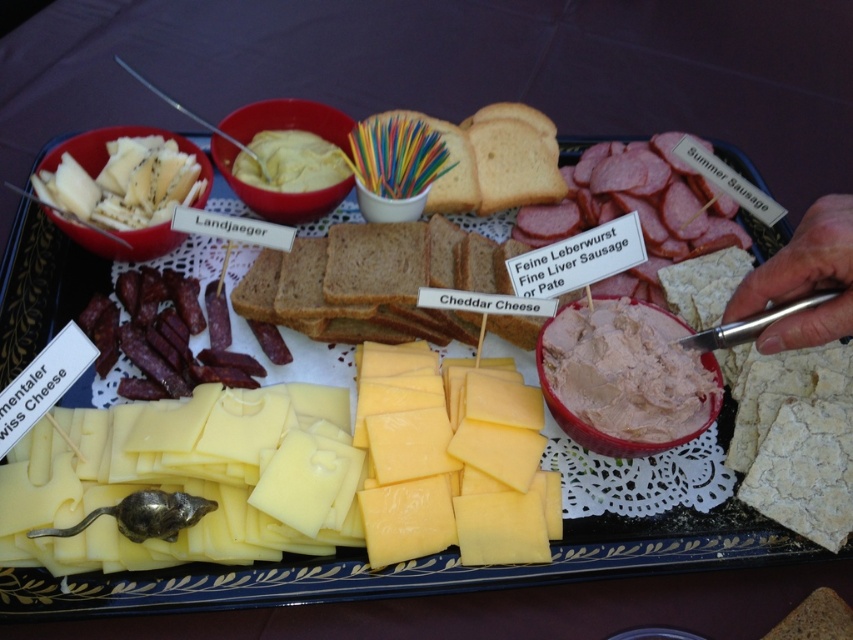
You are a guest at a party and see the brown matte bread at center and the white creamy spread at center on the charcuterie board. Which item is located below the other?

The brown matte bread at center is positioned under the white creamy spread at center, so the bread is below the spread.

Based on the photo, you are planning to place a decorative silver mouse on the charcuterie board. The mouse requires a space wider than the brown matte bread at center. Can the yellow hard cheese at center provide enough width for this?

The yellow hard cheese at center has a greater width than the brown matte bread at center, so it can accommodate the decorative silver mouse requiring more space than the bread.

You are planning to place a small decorative figurine on the charcuterie board. The figurine is 3 inches tall. Considering the brown matte bread at center and the white creamy spread at center, which item can the figurine be placed on without being hidden?

The brown matte bread at center is taller than the white creamy spread at center. Since the figurine is 3 inches tall, it can be placed on the brown matte bread at center as it is taller and less likely to hide the figurine compared to the shorter white creamy spread at center.